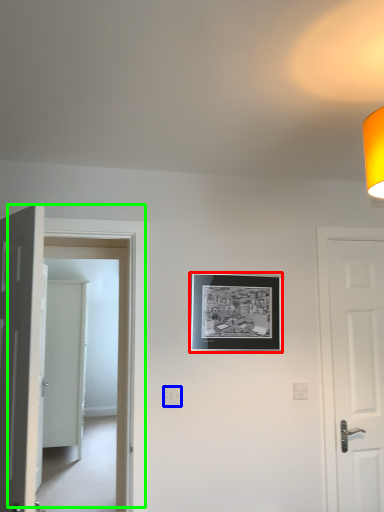
Question: Considering the real-world distances, which object is farthest from picture frame (highlighted by a red box)? electric outlet (highlighted by a blue box) or door (highlighted by a green box)?

Choices:
 (A) electric outlet
 (B) door

Answer: (A)